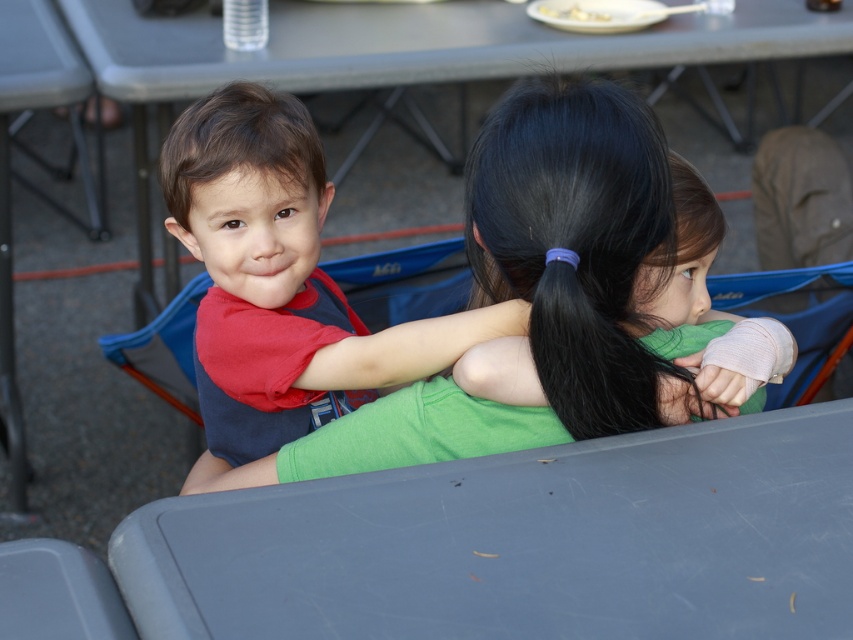
Question: Which point is farther to the camera?

Choices:
 (A) (555, 401)
 (B) (271, 496)
 (C) (677, 400)
 (D) (312, 13)

Answer: (D)

Question: Does matte red shirt at upper left appear on the left side of brown matte hair at upper left?

Choices:
 (A) yes
 (B) no

Answer: (B)

Question: Does black silky hair at upper center have a smaller size compared to smooth gray picnic table at center?

Choices:
 (A) no
 (B) yes

Answer: (B)

Question: Which point is closer to the camera?

Choices:
 (A) matte red shirt at upper left
 (B) black silky hair at upper center
 (C) brown matte hair at upper left

Answer: (A)

Question: Is gray plastic table at lower center in front of matte red shirt at upper left?

Choices:
 (A) no
 (B) yes

Answer: (B)

Question: Which of these objects is positioned farthest from the gray plastic table at lower center?

Choices:
 (A) matte red shirt at upper left
 (B) black silky hair at upper center
 (C) brown matte hair at upper left
 (D) smooth gray picnic table at center

Answer: (D)